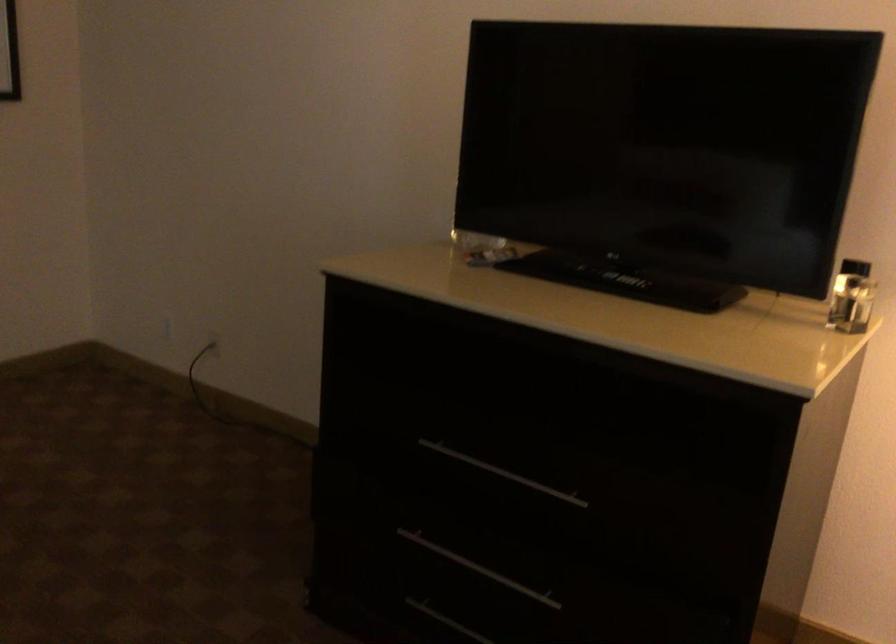
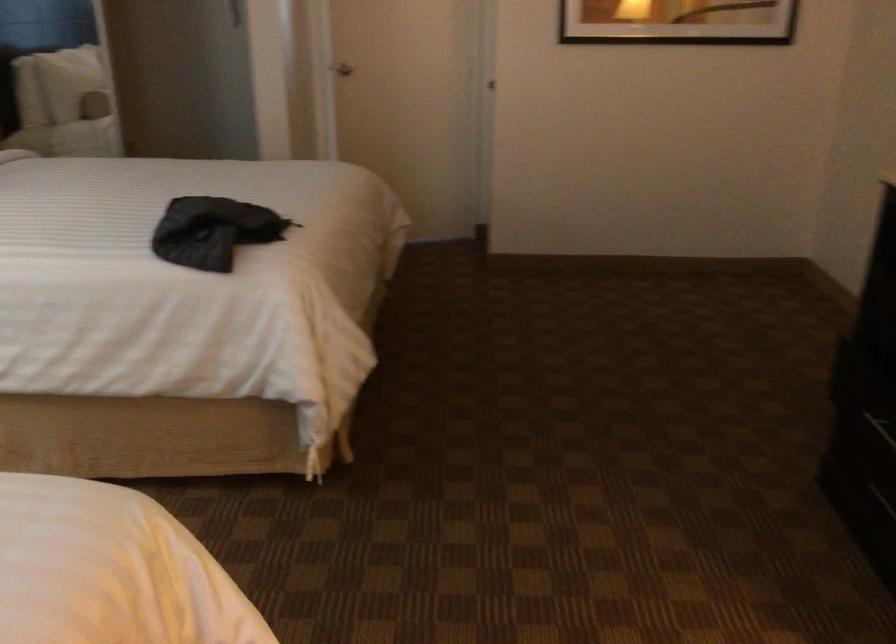
Question: Based on the continuous images, in which direction is the camera rotating? Reply with the corresponding letter.

Choices:
 (A) Left
 (B) Right
 (C) Up
 (D) Down

Answer: (A)